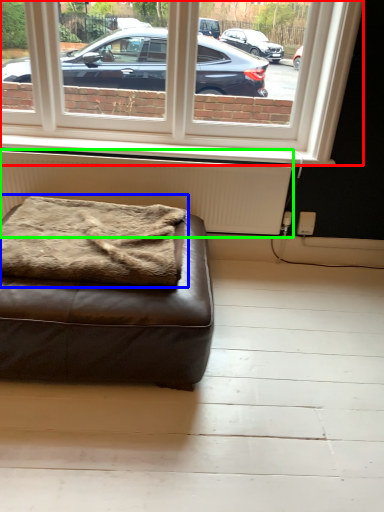
Question: Which is nearer to the window (highlighted by a red box)? blanket (highlighted by a blue box) or radiator (highlighted by a green box).

Choices:
 (A) blanket
 (B) radiator

Answer: (B)